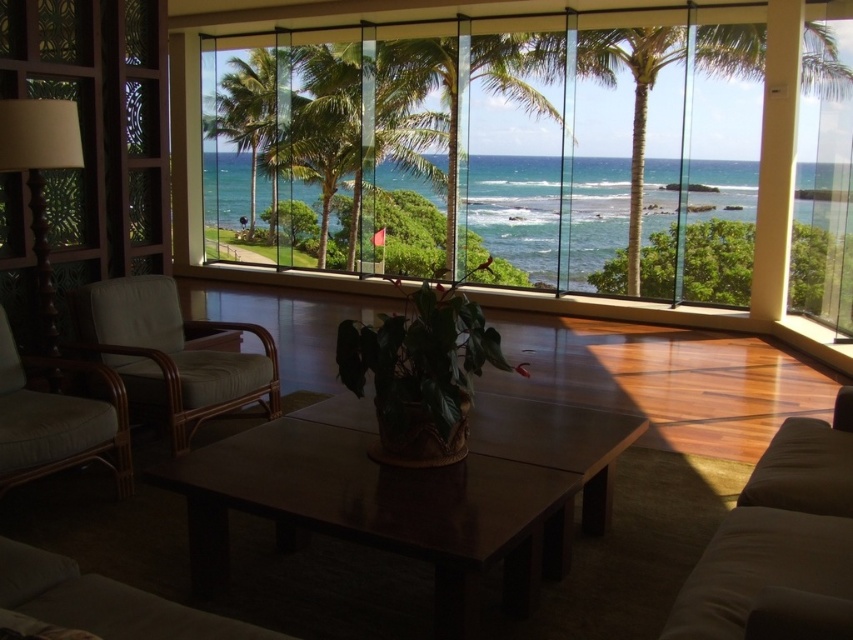
Question: Is white fabric couch at lower left smaller than green leafy palm tree at right?

Choices:
 (A) no
 (B) yes

Answer: (B)

Question: Which point is closer to the camera?

Choices:
 (A) (55, 168)
 (B) (164, 292)

Answer: (A)

Question: Is matte wood lamp at left bigger than green leafy palm tree at right?

Choices:
 (A) no
 (B) yes

Answer: (A)

Question: Which point appears closest to the camera in this image?

Choices:
 (A) (809, 486)
 (B) (457, 515)

Answer: (B)

Question: Which of the following is the closest to the observer?

Choices:
 (A) (45, 305)
 (B) (537, 64)
 (C) (181, 374)

Answer: (C)

Question: Does dark wood table at center have a lesser width compared to green leafy palm tree at right?

Choices:
 (A) yes
 (B) no

Answer: (A)